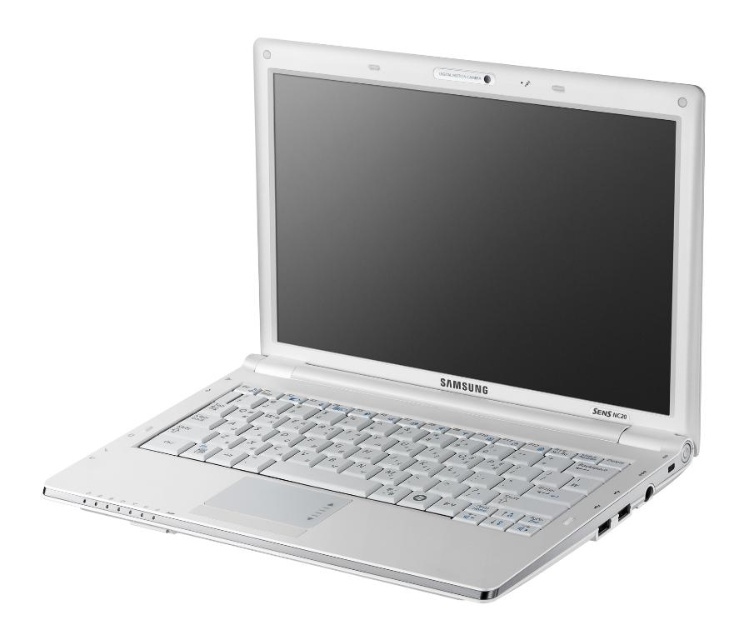
Does satin white screen at center have a lesser height compared to white plastic keyboard at center?

In fact, satin white screen at center may be taller than white plastic keyboard at center.

Is point (494, 339) closer to camera compared to point (234, 467)?

That is False.

Where is `satin white screen at center`? satin white screen at center is located at coordinates (476, 236).